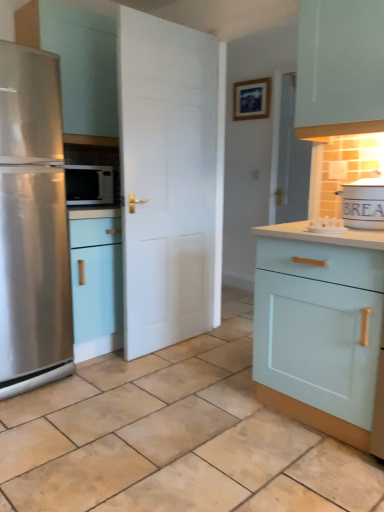
Question: Is light blue wood cabinet at right shorter than stainless steel refrigerator at left?

Choices:
 (A) yes
 (B) no

Answer: (A)

Question: Can you confirm if light blue wood cabinet at right is bigger than stainless steel refrigerator at left?

Choices:
 (A) yes
 (B) no

Answer: (B)

Question: Is light blue wood cabinet at right outside stainless steel refrigerator at left?

Choices:
 (A) yes
 (B) no

Answer: (A)

Question: Is light blue wood cabinet at right wider than stainless steel refrigerator at left?

Choices:
 (A) yes
 (B) no

Answer: (B)

Question: Does light blue wood cabinet at right lie behind stainless steel refrigerator at left?

Choices:
 (A) yes
 (B) no

Answer: (B)

Question: In the image, is white matte tin canister at upper right on the left side or the right side of beige tile at center?

Choices:
 (A) right
 (B) left

Answer: (A)

Question: Considering their positions, is white matte tin canister at upper right located in front of or behind beige tile at center?

Choices:
 (A) behind
 (B) front

Answer: (A)

Question: Is white matte tin canister at upper right inside the boundaries of beige tile at center, or outside?

Choices:
 (A) outside
 (B) inside

Answer: (A)

Question: Looking at their shapes, would you say white matte tin canister at upper right is wider or thinner than beige tile at center?

Choices:
 (A) thin
 (B) wide

Answer: (A)

Question: From the image's perspective, is beige tile at center located above or below satin black microwave at left?

Choices:
 (A) above
 (B) below

Answer: (B)

Question: Which is correct: beige tile at center is inside satin black microwave at left, or outside of it?

Choices:
 (A) outside
 (B) inside

Answer: (A)

Question: From a real-world perspective, relative to satin black microwave at left, is beige tile at center vertically above or below?

Choices:
 (A) above
 (B) below

Answer: (B)

Question: In the image, is beige tile at center positioned in front of or behind satin black microwave at left?

Choices:
 (A) front
 (B) behind

Answer: (A)

Question: Is point (33, 293) positioned closer to the camera than point (162, 132)?

Choices:
 (A) farther
 (B) closer

Answer: (B)

Question: From the image's perspective, is stainless steel refrigerator at left positioned above or below white matte door at center?

Choices:
 (A) above
 (B) below

Answer: (B)